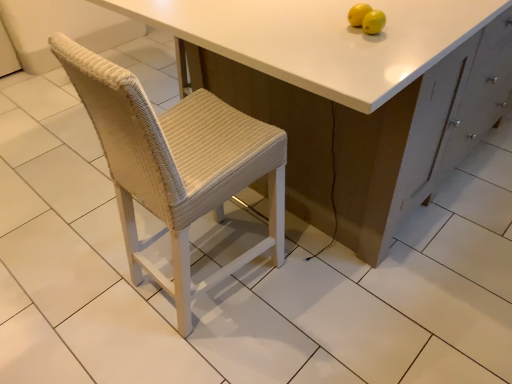
Question: From a real-world perspective, is matte white cabinet at center positioned above or below yellow matte lemons at upper right?

Choices:
 (A) above
 (B) below

Answer: (B)

Question: In the image, is matte white cabinet at center on the left side or the right side of yellow matte lemons at upper right?

Choices:
 (A) left
 (B) right

Answer: (B)

Question: From the image's perspective, is matte white cabinet at center located above or below yellow matte lemons at upper right?

Choices:
 (A) below
 (B) above

Answer: (B)

Question: From the image's perspective, is yellow matte lemons at upper right above or below matte white cabinet at center?

Choices:
 (A) below
 (B) above

Answer: (A)

Question: From a real-world perspective, is yellow matte lemons at upper right physically located above or below matte white cabinet at center?

Choices:
 (A) below
 (B) above

Answer: (B)

Question: Considering their positions, is yellow matte lemons at upper right located in front of or behind matte white cabinet at center?

Choices:
 (A) behind
 (B) front

Answer: (A)

Question: Is point click(371, 16) closer or farther from the camera than point click(305, 97)?

Choices:
 (A) farther
 (B) closer

Answer: (B)